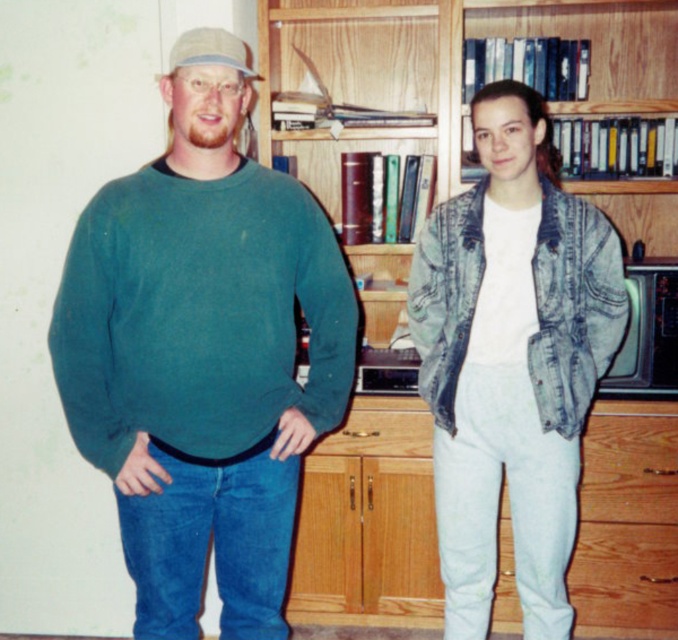
Question: Which object appears farthest from the camera in this image?

Choices:
 (A) denim jacket at center
 (B) teal matte sweater at left
 (C) wooden bookcase at center

Answer: (C)

Question: Is denim jacket at center to the right of wooden bookcase at center from the viewer's perspective?

Choices:
 (A) no
 (B) yes

Answer: (A)

Question: Which object is closer to the camera taking this photo?

Choices:
 (A) teal matte sweater at left
 (B) wooden bookcase at center

Answer: (A)

Question: Can you confirm if teal matte sweater at left is wider than wooden bookcase at center?

Choices:
 (A) no
 (B) yes

Answer: (A)

Question: Which object is positioned closest to the denim jacket at center?

Choices:
 (A) teal matte sweater at left
 (B) wooden bookcase at center

Answer: (A)

Question: Is denim jacket at center to the right of wooden bookcase at center from the viewer's perspective?

Choices:
 (A) yes
 (B) no

Answer: (B)